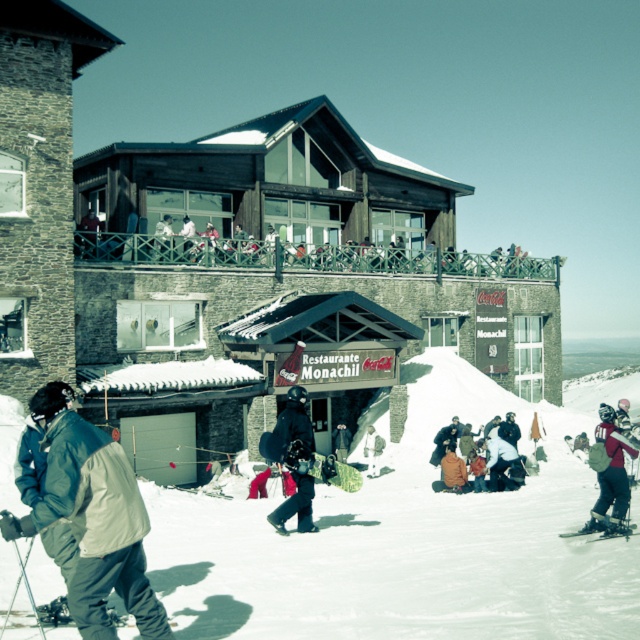
Is green fabric jacket at lower left positioned before matte black snowboarder at center?

Yes.

How distant is green fabric jacket at lower left from matte black snowboarder at center?

green fabric jacket at lower left and matte black snowboarder at center are 36.28 feet apart.

Does point (108, 465) lie behind point (282, 452)?

No, it is not.

Find the location of a particular element. The height and width of the screenshot is (640, 640). green fabric jacket at lower left is located at coordinates (92, 516).

Is wooden ski resort at center smaller than green fabric jacket at lower left?

No, wooden ski resort at center is not smaller than green fabric jacket at lower left.

What do you see at coordinates (234, 268) in the screenshot?
I see `wooden ski resort at center` at bounding box center [234, 268].

Is point (436, 289) closer to camera compared to point (64, 422)?

No, it is behind (64, 422).

You are a GUI agent. You are given a task and a screenshot of the screen. Output one action in this format:
    pyautogui.click(x=<x>, y=<y>)
    Task: Click on the wooden ski resort at center
    This screenshot has width=640, height=640.
    Given the screenshot: What is the action you would take?
    pyautogui.click(x=234, y=268)

Which is behind, point (348, 484) or point (612, 536)?

The point (348, 484) is more distant.

Between green matte snowboard at center and metallic silver ski at lower right, which one is positioned lower?

Positioned lower is metallic silver ski at lower right.

Is point (314, 476) positioned before point (602, 536)?

Yes, point (314, 476) is in front of point (602, 536).

Image resolution: width=640 pixels, height=640 pixels. I want to click on green matte snowboard at center, so click(308, 461).